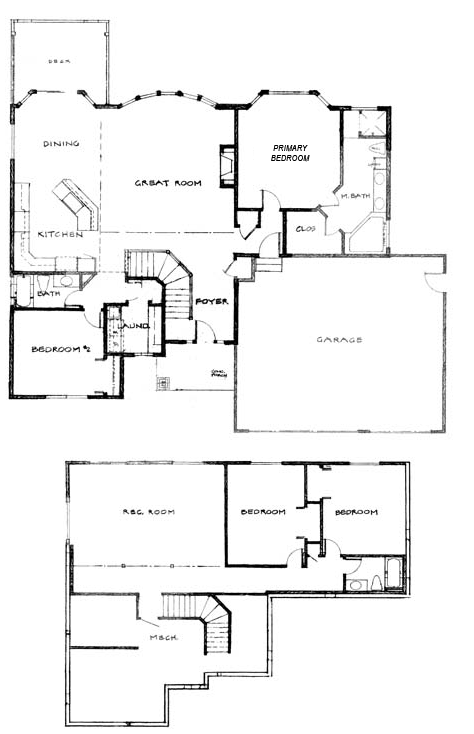
Identify the location of bedroom. The height and width of the screenshot is (734, 474). (265, 517), (362, 514), (63, 352).